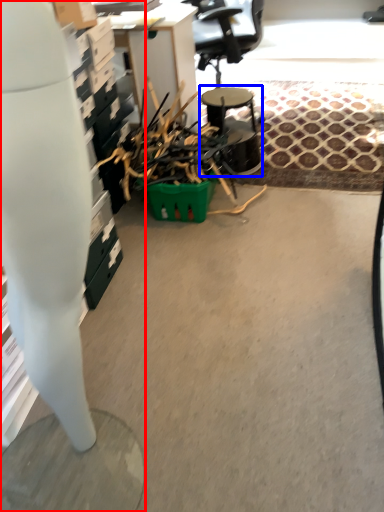
Question: Which object appears farthest to the camera in this image, desk (highlighted by a red box) or round table (highlighted by a blue box)?

Choices:
 (A) desk
 (B) round table

Answer: (B)